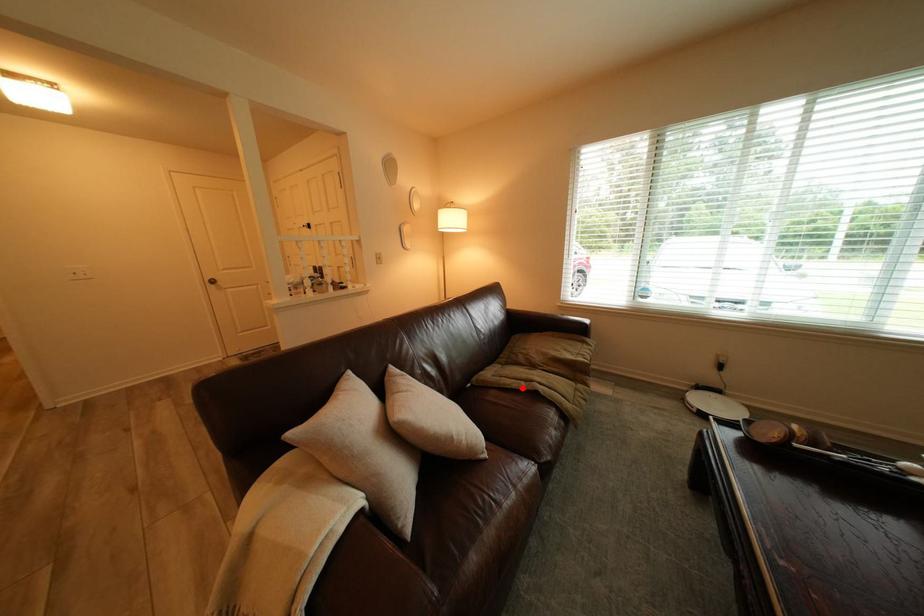
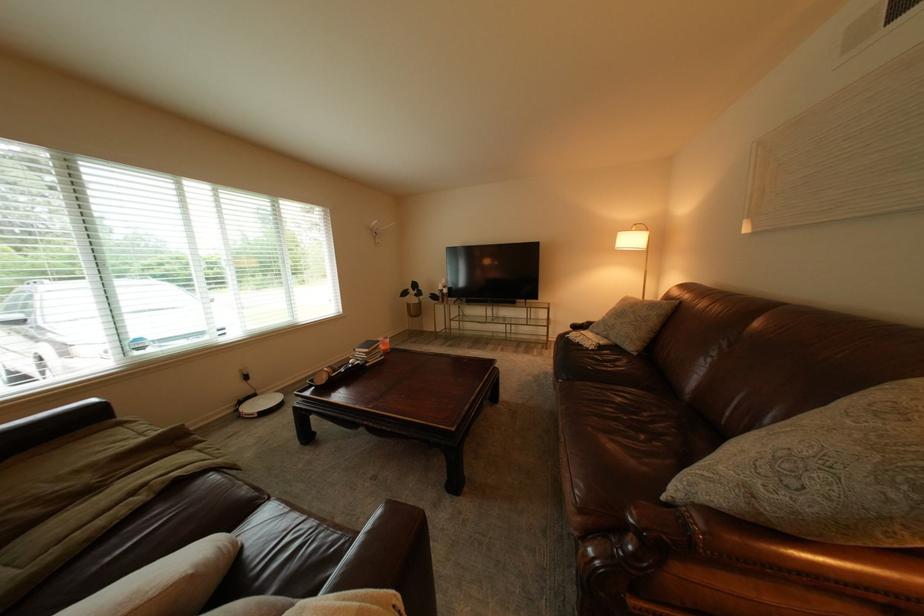
Question: I am providing you with two images of the same scene from different viewpoints. Image1 has a red point marked. In image2, the corresponding 3D location appears at what relative position? Reply with the corresponding letter.

Choices:
 (A) Closer
 (B) Farther

Answer: (B)